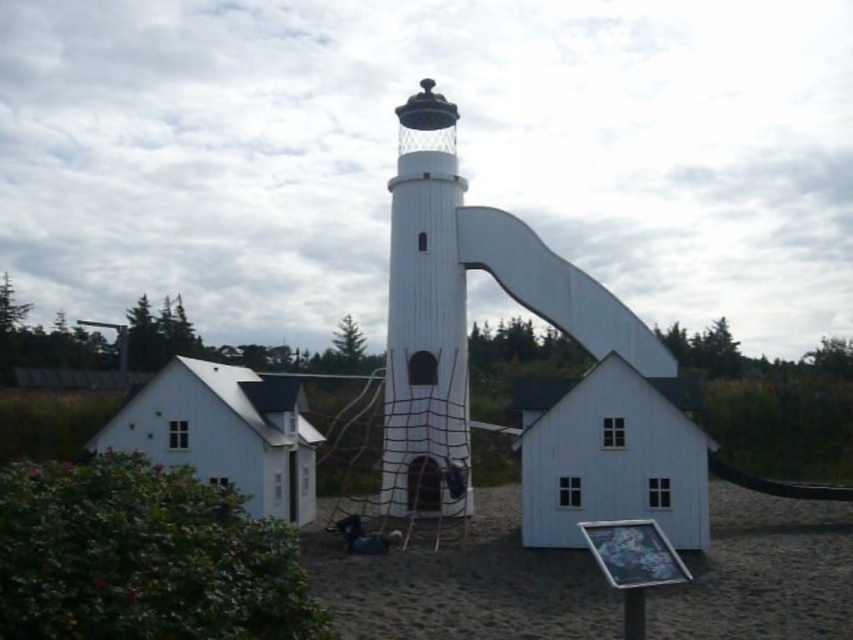
Question: Does brown sandy ground at center come behind white wood tower at center?

Choices:
 (A) yes
 (B) no

Answer: (B)

Question: Can you confirm if brown sandy ground at center is positioned above white wood tower at center?

Choices:
 (A) no
 (B) yes

Answer: (A)

Question: Which object is farther from the camera taking this photo?

Choices:
 (A) brown sandy ground at center
 (B) white wood tower at center

Answer: (B)

Question: Which of the following is the farthest from the observer?

Choices:
 (A) brown sandy ground at center
 (B) white wood tower at center

Answer: (B)

Question: Does brown sandy ground at center come in front of white wood tower at center?

Choices:
 (A) yes
 (B) no

Answer: (A)